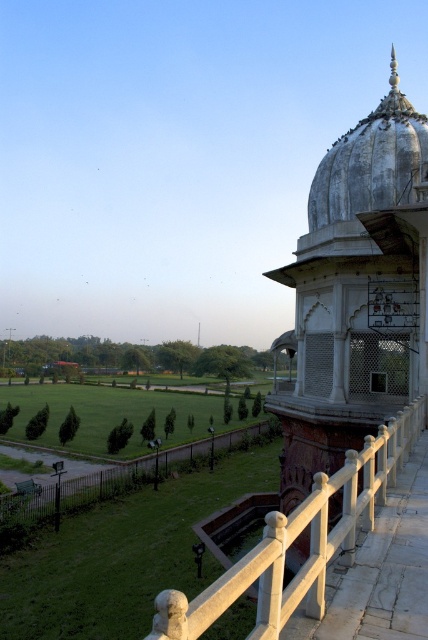
Question: Which point is closer to the camera taking this photo?

Choices:
 (A) (297, 516)
 (B) (64, 509)

Answer: (A)

Question: Does white stone railing at lower right appear on the left side of white stone railing at lower center?

Choices:
 (A) yes
 (B) no

Answer: (B)

Question: Which point appears farthest from the camera in this image?

Choices:
 (A) (x=178, y=454)
 (B) (x=318, y=614)

Answer: (A)

Question: Where is white stone railing at lower right located in relation to white stone railing at lower center in the image?

Choices:
 (A) left
 (B) right

Answer: (B)

Question: Is white stone railing at lower right bigger than white stone railing at lower center?

Choices:
 (A) yes
 (B) no

Answer: (B)

Question: Which of the following is the closest to the observer?

Choices:
 (A) white stone railing at lower center
 (B) white stone railing at lower right

Answer: (B)